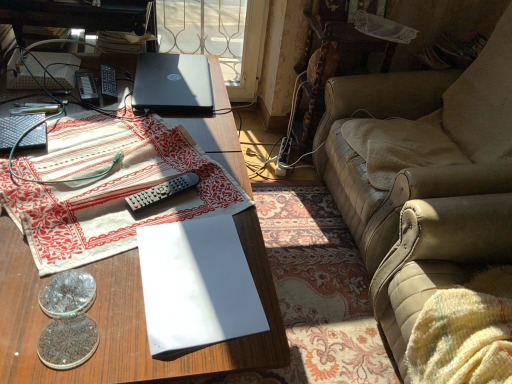
This screenshot has width=512, height=384. Find the location of `vacant area that is situated to the right of black plastic remote control at center, which appears as the first remote control when viewed from the back`. vacant area that is situated to the right of black plastic remote control at center, which appears as the first remote control when viewed from the back is located at coordinates (156, 95).